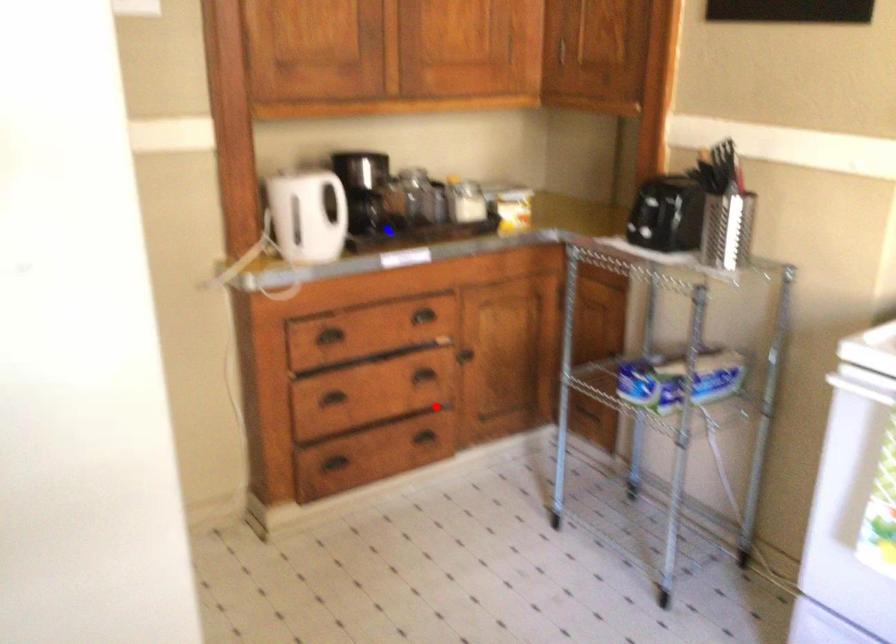
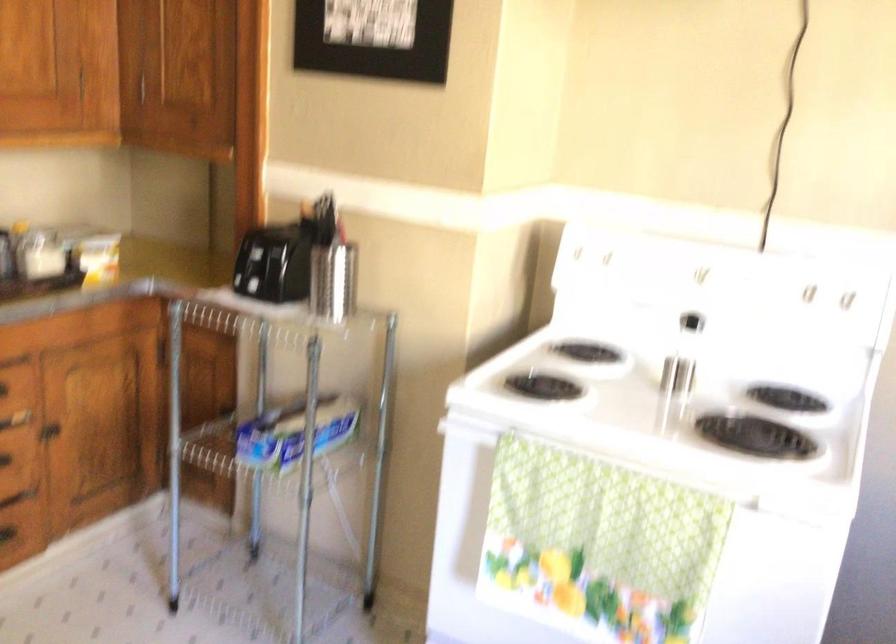
Where in the second image is the point corresponding to the highlighted location from the first image?

(22, 493)